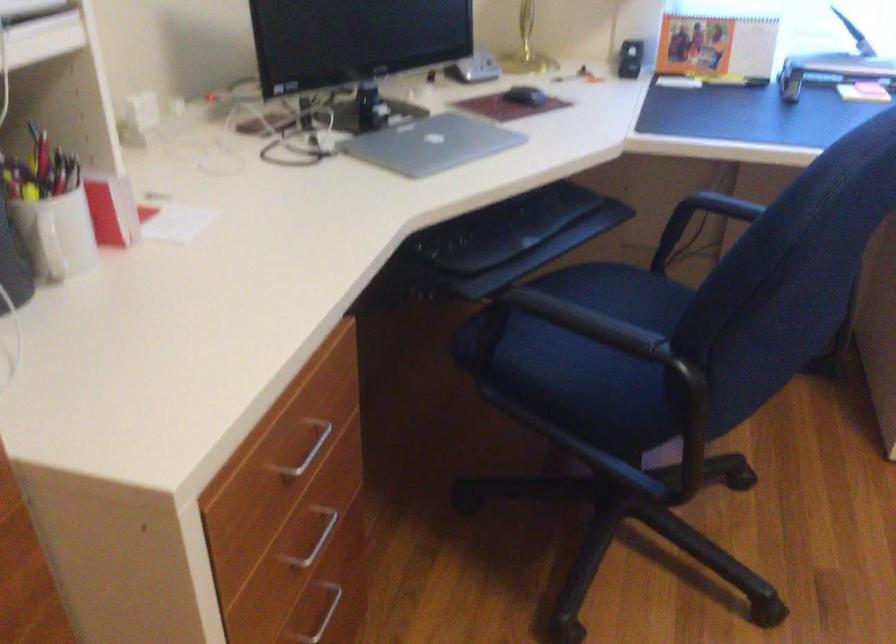
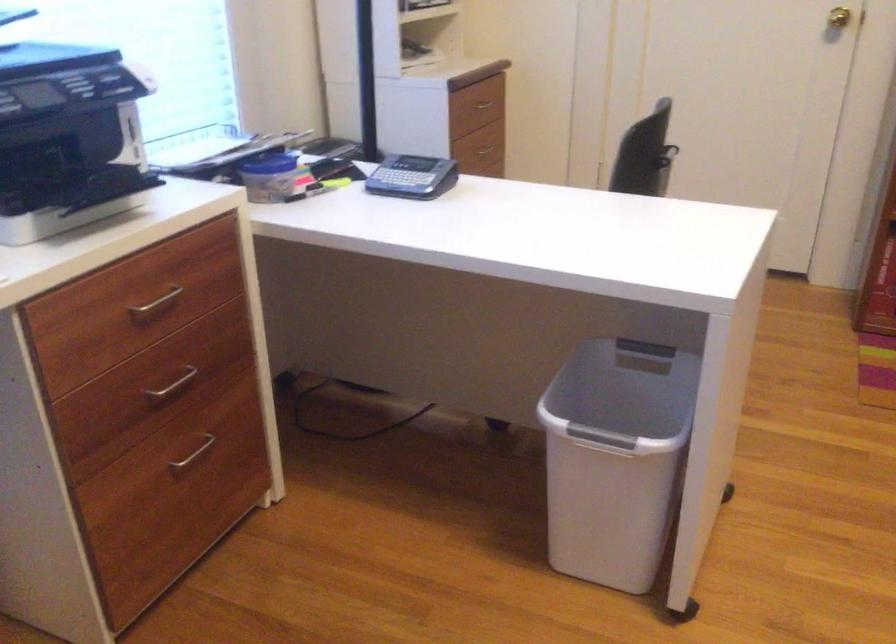
From the picture: The first image is from the beginning of the video and the second image is from the end. How did the camera likely rotate when shooting the video?

The rotation direction of the camera is right-down.